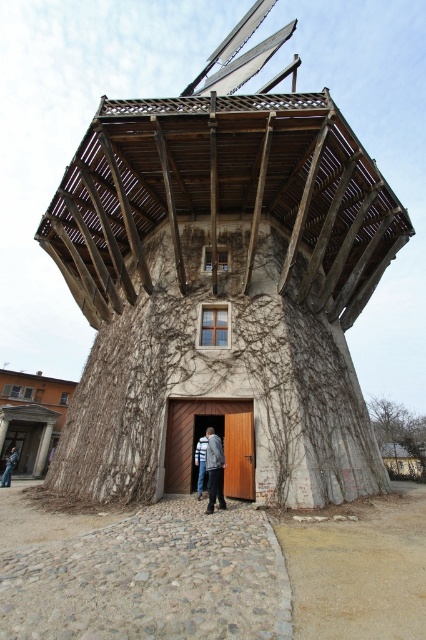
Is white stone building at lower left taller than green leafy tree at upper right?

Incorrect, white stone building at lower left's height is not larger of green leafy tree at upper right's.

Can you confirm if white stone building at lower left is positioned below green leafy tree at upper right?

No.

Image resolution: width=426 pixels, height=640 pixels. In order to click on white stone building at lower left in this screenshot , I will do `click(31, 417)`.

Where is `white stone building at lower left`? white stone building at lower left is located at coordinates (31, 417).

Does point (299, 152) come farther from viewer compared to point (16, 449)?

No.

Which is below, wooden windmill at center or denim jacket at lower left?

denim jacket at lower left

Identify the location of wooden windmill at center. (221, 291).

You are a GUI agent. You are given a task and a screenshot of the screen. Output one action in this format:
    pyautogui.click(x=<x>, y=<y>)
    Task: Click on the wooden windmill at center
    Image resolution: width=426 pixels, height=640 pixels.
    Given the screenshot: What is the action you would take?
    pyautogui.click(x=221, y=291)

Between point (244, 488) and point (37, 476), which one is positioned in front?

Point (244, 488)

Is point (235, 406) less distant than point (5, 454)?

Yes, it is.

Where is `wooden windmill at center`? wooden windmill at center is located at coordinates (221, 291).